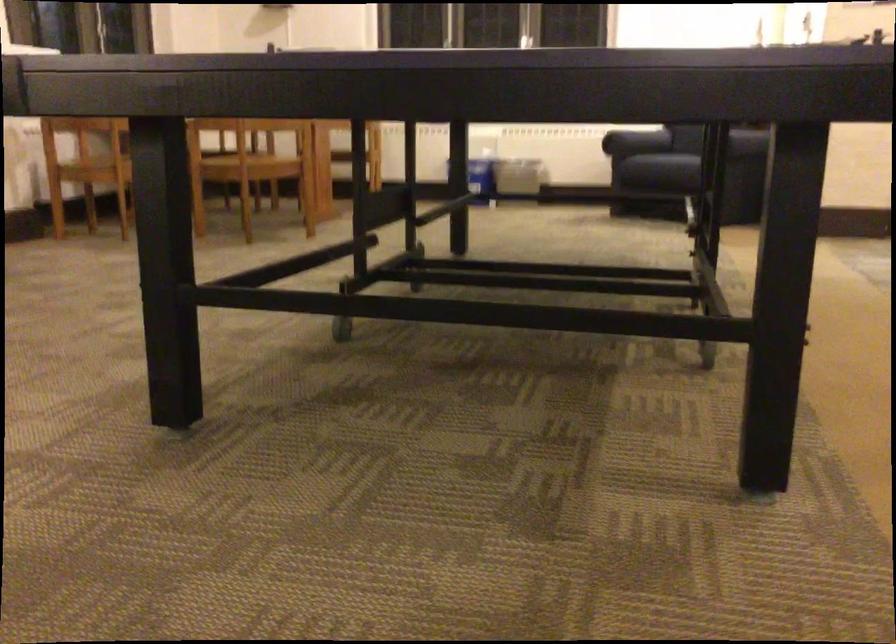
What do you see at coordinates (633, 143) in the screenshot?
I see `the sofa armrest` at bounding box center [633, 143].